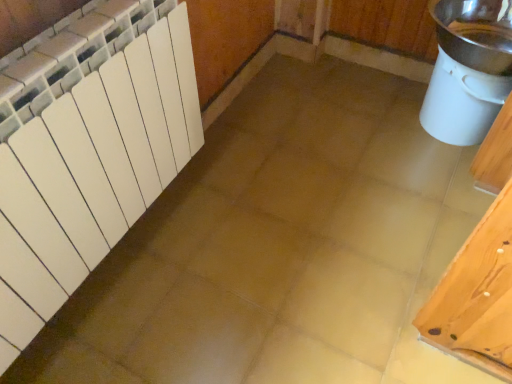
This screenshot has height=384, width=512. In order to click on free space below white matte radiator at left (from a real-world perspective) in this screenshot , I will do `click(96, 294)`.